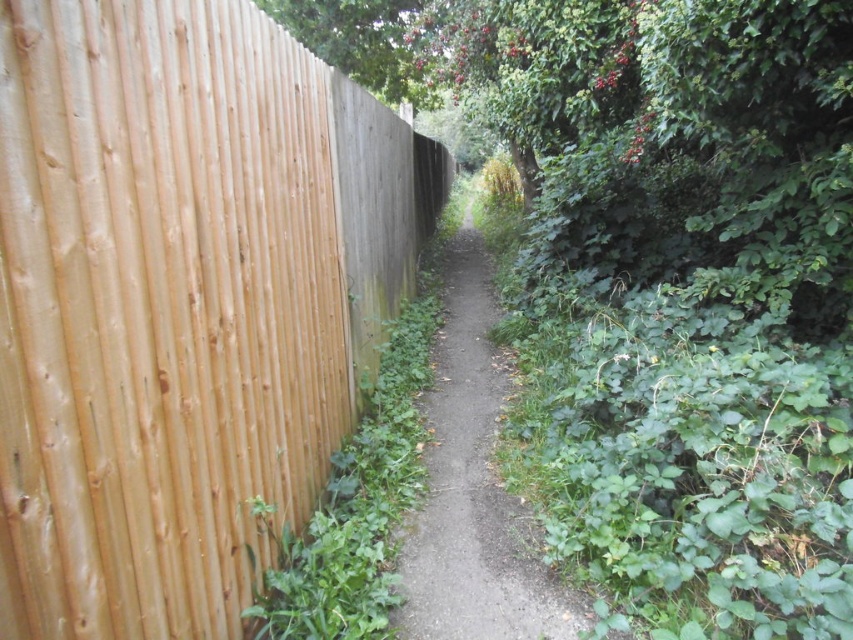
Question: Does natural wood fence at left have a greater width compared to dirt path at center?

Choices:
 (A) no
 (B) yes

Answer: (A)

Question: Which point is closer to the camera?

Choices:
 (A) dirt path at center
 (B) natural wood fence at left

Answer: (B)

Question: Which point appears farthest from the camera in this image?

Choices:
 (A) (444, 266)
 (B) (260, 20)

Answer: (A)

Question: Can you confirm if natural wood fence at left is wider than dirt path at center?

Choices:
 (A) yes
 (B) no

Answer: (B)

Question: Is natural wood fence at left below dirt path at center?

Choices:
 (A) no
 (B) yes

Answer: (A)